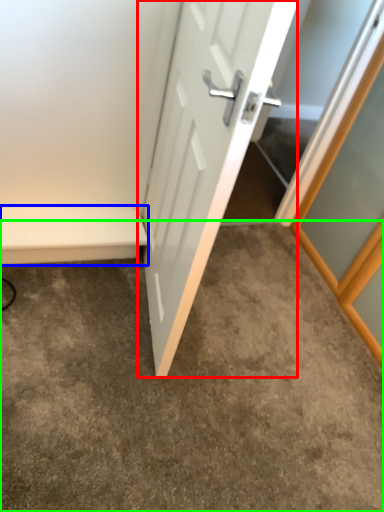
Question: Based on their relative distances, which object is farther from door (highlighted by a red box)? Choose from balustrade (highlighted by a blue box) and concrete (highlighted by a green box).

Choices:
 (A) balustrade
 (B) concrete

Answer: (B)